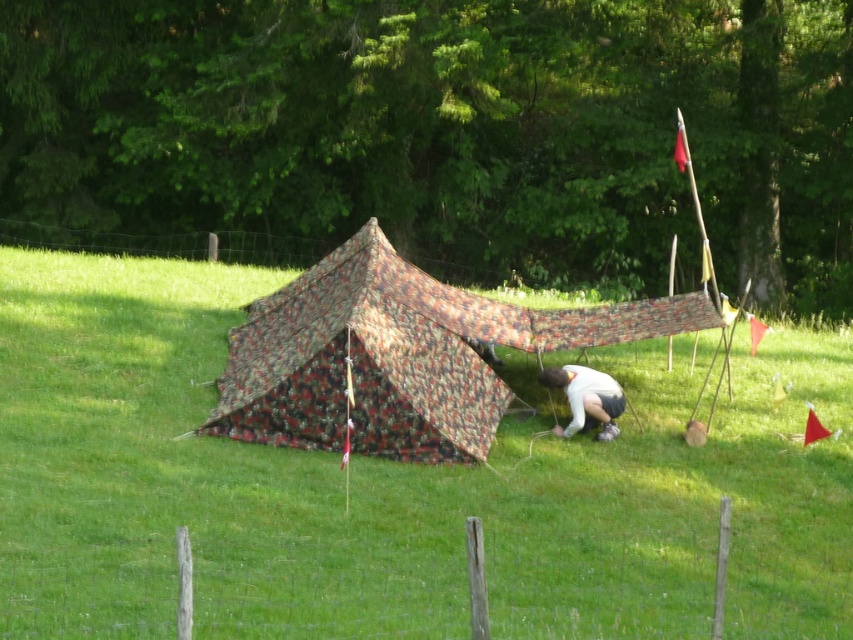
You are a hiker who just arrived at the campsite and see the camouflage fabric tent at center and the white fabric at center. Which fabric is closer to you?

The camouflage fabric tent at center is closer to the viewer than the white fabric at center.

You are a hiker who wants to set up a tent. You have a map that shows the green grass at center and camouflage fabric tent at center. According to the map, which object is closer to you if you are facing the scene?

The green grass at center is closer to you because it is in front of the camouflage fabric tent at center.

You are planning to place a new tent in the grassy field. The current tent is set up at the green grass at center. According to the coordinates provided, where should you place the new tent to ensure it is exactly 1 meter north of the existing one?

The new tent should be placed at coordinates north of the green grass at center, but the exact coordinates depend on the scale of the image. Since the original coordinates are given as point coordinates without scale information, it is not possible to determine the precise location for 1 meter north without additional data.